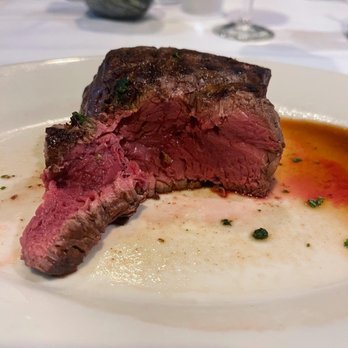
What are the coordinates of `glasses on table` in the screenshot? It's located at (234, 30), (209, 11), (170, 3).